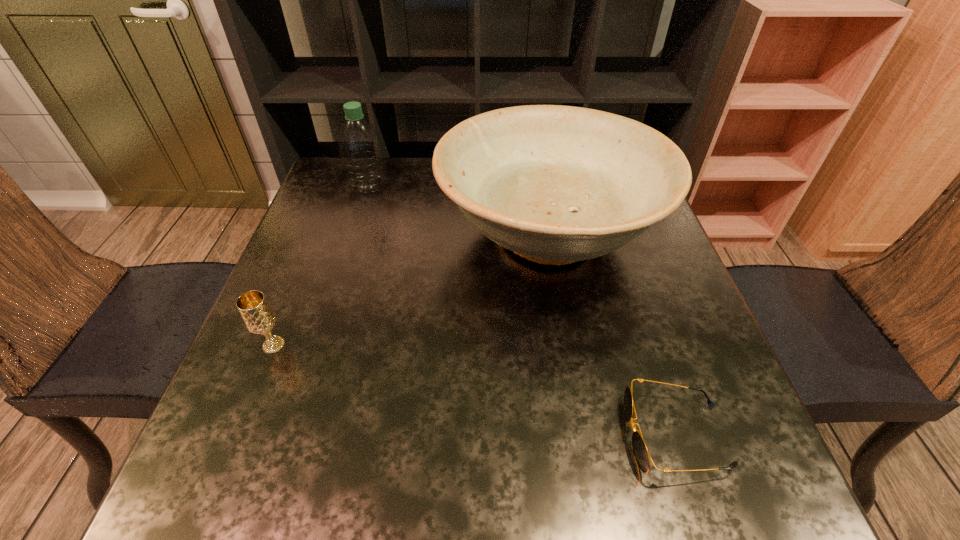
Where is `vacant space that's between the nearest object and the leftmost object`? The width and height of the screenshot is (960, 540). vacant space that's between the nearest object and the leftmost object is located at coordinates (474, 390).

At what (x,y) coordinates should I click in order to perform the action: click on vacant area that lies between the dish and the shortest object. Please return your answer as a coordinate pair (x, y). The width and height of the screenshot is (960, 540). Looking at the image, I should click on (612, 335).

Locate an element on the screen. free space between the dish and the third tallest object is located at coordinates (411, 289).

The height and width of the screenshot is (540, 960). I want to click on empty location between the shortest object and the dish, so click(x=612, y=335).

Locate an element on the screen. The width and height of the screenshot is (960, 540). empty location between the nearest object and the second object from left to right is located at coordinates (521, 310).

I want to click on free spot between the nearest object and the third farthest object, so click(474, 390).

I want to click on blank region between the third object from right to left and the second nearest object, so click(321, 266).

Identify the location of free spot between the water bottle and the shortest object. (521, 310).

Locate an element on the screen. This screenshot has width=960, height=540. object that ranks as the third closest to the second nearest object is located at coordinates (642, 456).

Point out which object is positioned as the second nearest to the nearest object. Please provide its 2D coordinates. Your answer should be formatted as a tuple, i.e. [(x, y)], where the tuple contains the x and y coordinates of a point satisfying the conditions above.

[(259, 318)]